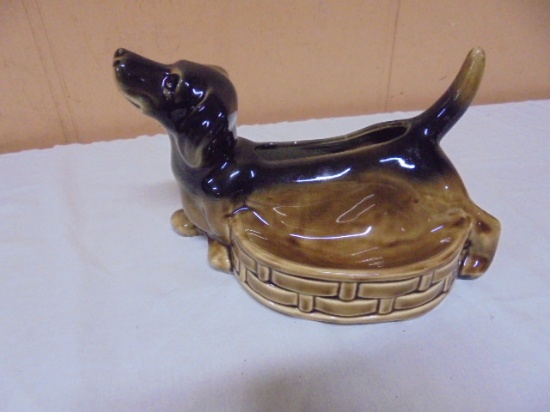
You are a GUI agent. You are given a task and a screenshot of the screen. Output one action in this format:
    pyautogui.click(x=<x>, y=<y>)
    Task: Click on the white table
    The image size is (550, 412).
    Given the screenshot: What is the action you would take?
    pyautogui.click(x=280, y=343)